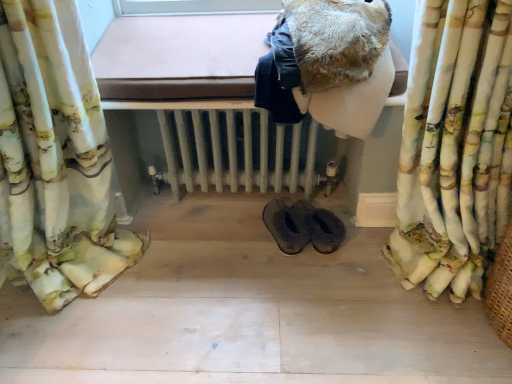
This screenshot has width=512, height=384. What are the coordinates of `vacant area that lies in front of white painted radiator at center` in the screenshot? It's located at point(231,286).